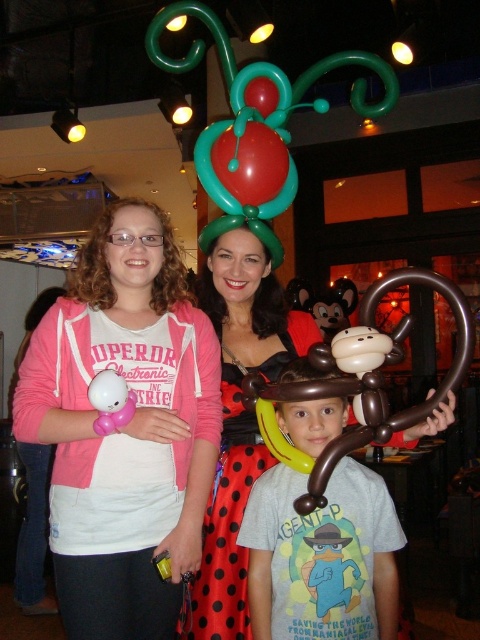
Is shiny red balloon at center to the right of white matte balloon at lower left from the viewer's perspective?

Indeed, shiny red balloon at center is positioned on the right side of white matte balloon at lower left.

You are a GUI agent. You are given a task and a screenshot of the screen. Output one action in this format:
    pyautogui.click(x=<x>, y=<y>)
    Task: Click on the shiny red balloon at center
    
    Given the screenshot: What is the action you would take?
    pyautogui.click(x=251, y=163)

Can you confirm if pink fleece jacket at upper left is positioned below shiny red balloon at center?

Yes, pink fleece jacket at upper left is below shiny red balloon at center.

Does pink fleece jacket at upper left lie in front of shiny red balloon at center?

Yes, it is.

Locate an element on the screen. pink fleece jacket at upper left is located at coordinates (123, 428).

Is point (328, 428) more distant than point (230, 332)?

No, it is in front of (230, 332).

In order to click on brown rubber balloon monkey at center in this screenshot , I will do (x=322, y=557).

Is point (289, 604) positioned in front of point (242, 282)?

Yes, it is in front of point (242, 282).

In order to click on brown rubber balloon monkey at center in this screenshot , I will do `click(322, 557)`.